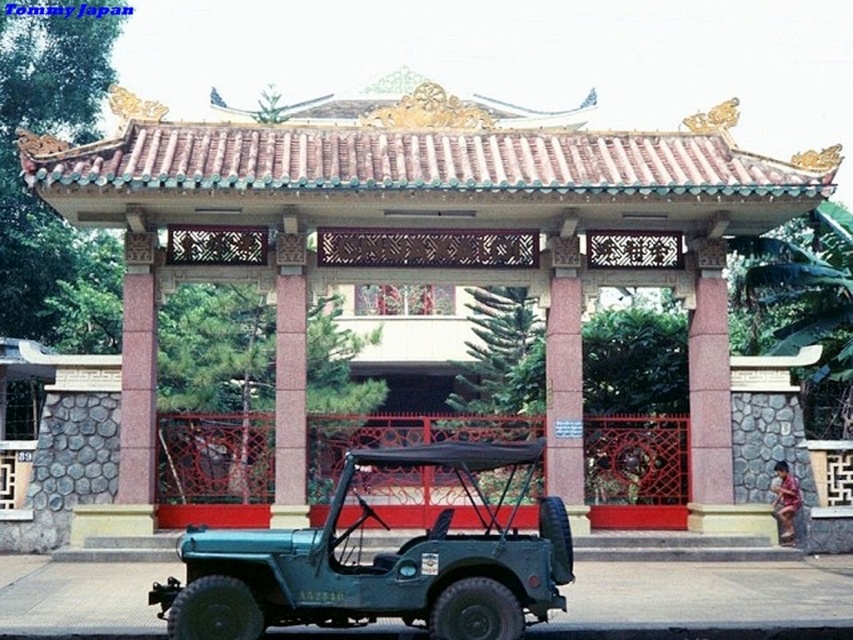
You are standing in front of the traditional Chinese gate and want to take a photo. You notice two points marked on the gate at coordinates point [711,396] and point [387,595]. Which point is closer to your camera lens when taking the photo?

Point [387,595] is closer to the camera lens because it is less further than point [711,396] according to the description.

You are planning to host a small event and need to determine seating arrangements. You have a matte pink gazebo at center and a teal matte jeep at center available. Which object can accommodate more guests comfortably?

The matte pink gazebo at center has a larger size compared to the teal matte jeep at center, so it can accommodate more guests comfortably.

You are standing in front of a traditional Chinese gate and see a matte pink gazebo at center and a teal matte jeep at center. Which object is positioned to the right of the other?

The matte pink gazebo at center is to the right of the teal matte jeep at center.